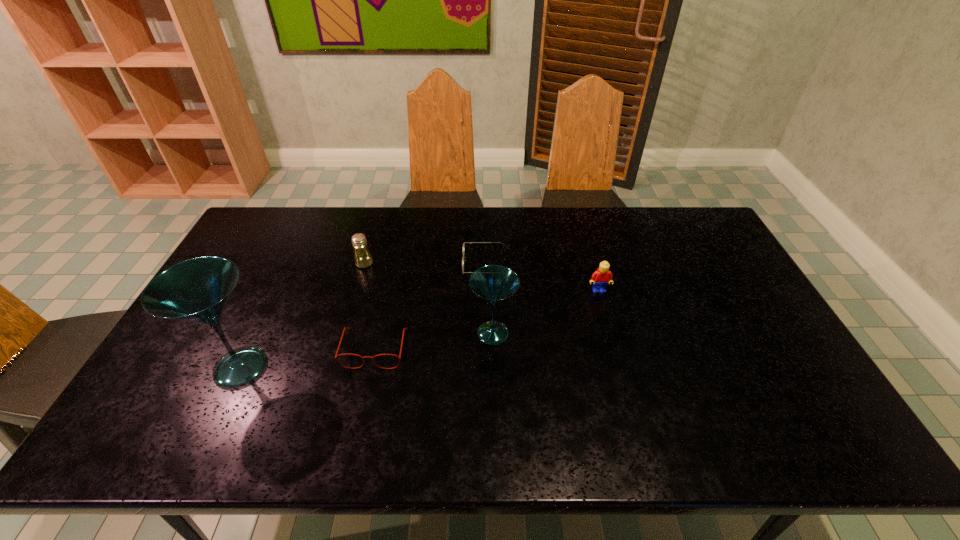
The width and height of the screenshot is (960, 540). I want to click on vacant space at the far edge, so click(x=475, y=242).

You are a GUI agent. You are given a task and a screenshot of the screen. Output one action in this format:
    pyautogui.click(x=<x>, y=<y>)
    Task: Click on the free space at the near edge of the desktop
    The width and height of the screenshot is (960, 540).
    Given the screenshot: What is the action you would take?
    pyautogui.click(x=690, y=402)

You are a GUI agent. You are given a task and a screenshot of the screen. Output one action in this format:
    pyautogui.click(x=<x>, y=<y>)
    Task: Click on the vacant area at the left edge
    
    Given the screenshot: What is the action you would take?
    pyautogui.click(x=237, y=285)

This screenshot has width=960, height=540. In the image, there is a desktop. Find the location of `free space at the right edge`. free space at the right edge is located at coordinates (697, 274).

This screenshot has height=540, width=960. I want to click on free point between the leftmost object and the shorter martini, so click(367, 350).

Where is `empty space between the right martini and the spectacles`? empty space between the right martini and the spectacles is located at coordinates (434, 341).

You are a GUI agent. You are given a task and a screenshot of the screen. Output one action in this format:
    pyautogui.click(x=<x>, y=<y>)
    Task: Click on the blank region between the saltshaker and the leftmost object
    This screenshot has height=540, width=960.
    Given the screenshot: What is the action you would take?
    pyautogui.click(x=302, y=315)

Find the location of a particular element. This screenshot has height=540, width=960. free area in between the sunglasses and the saltshaker is located at coordinates (425, 264).

Locate an element on the screen. vacant point located between the shortest object and the second shortest object is located at coordinates (431, 306).

This screenshot has width=960, height=540. What are the coordinates of `empty space that is in between the saltshaker and the taller martini` in the screenshot? It's located at (302, 315).